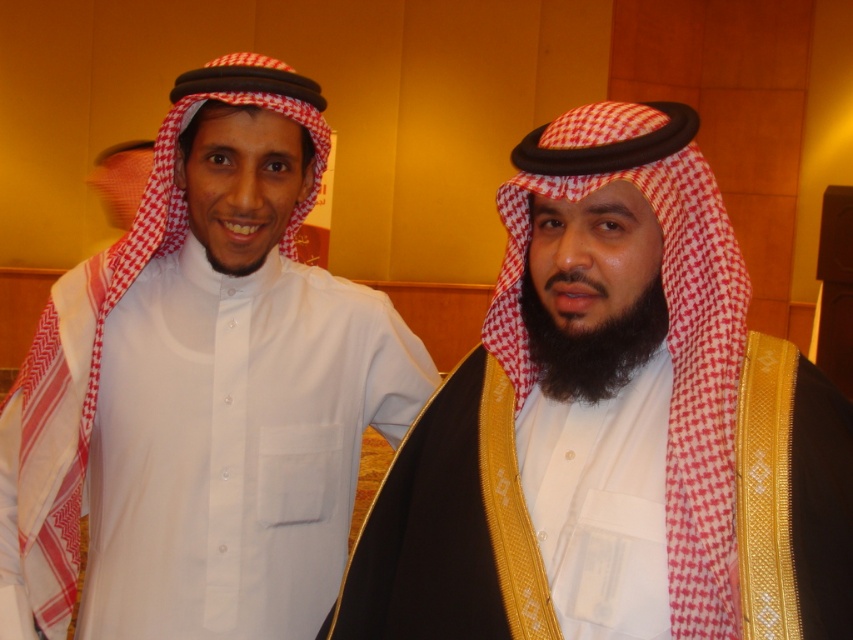
You are an observer in the scene. You notice two white items in the image. One is the white fabric headscarf at right and the other is the white matte shirt at center. Which of these two items is positioned more to the right?

The white fabric headscarf at right is positioned more to the right than the white matte shirt at center.

You are an interior designer and need to place a small decorative item at the exact location of point (614, 426) in the image. According to the scene description, what object will the item be placed on?

The point (614, 426) corresponds to the white fabric headscarf at right, so the item will be placed on the white fabric headscarf at right.